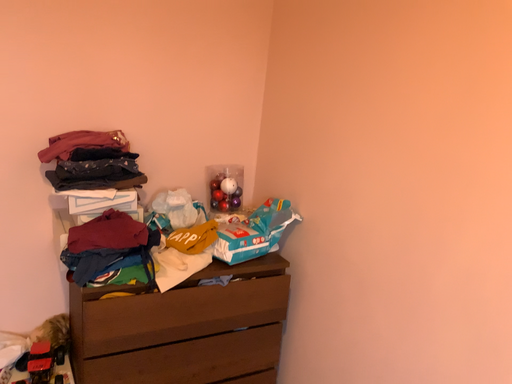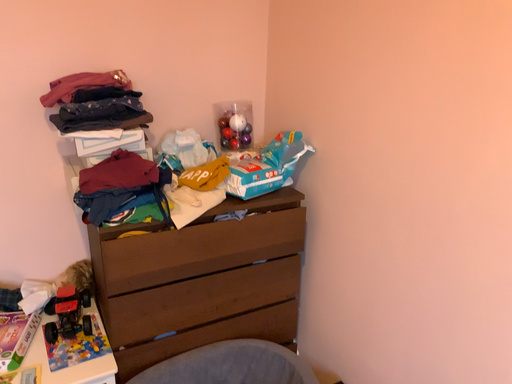
Question: How did the camera likely rotate when shooting the video?

Choices:
 (A) rotated downward
 (B) rotated upward

Answer: (A)